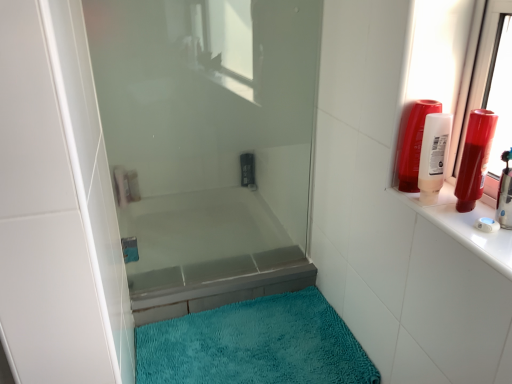
Find the location of a particular element. vacant space underneath transparent glass shower door at center (from a real-world perspective) is located at coordinates (204, 277).